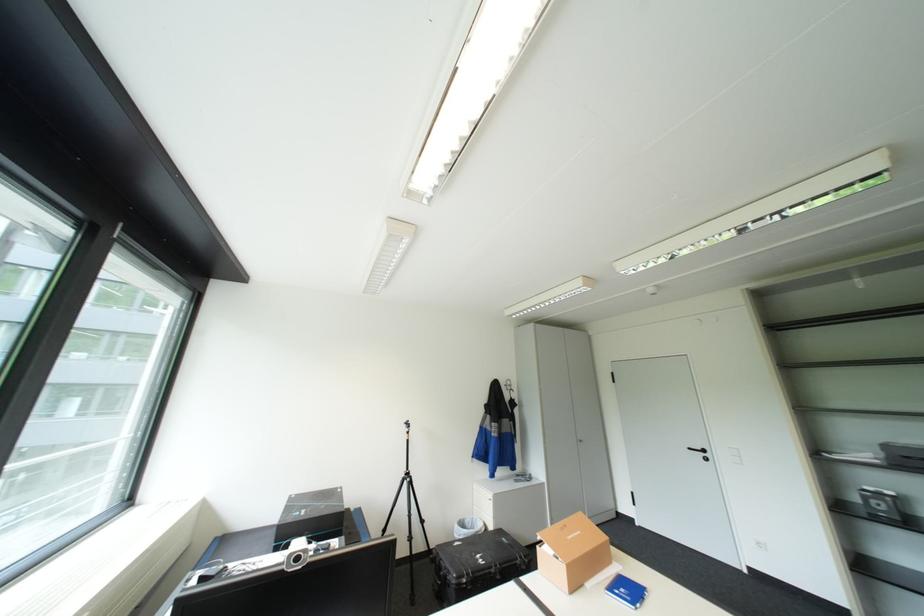
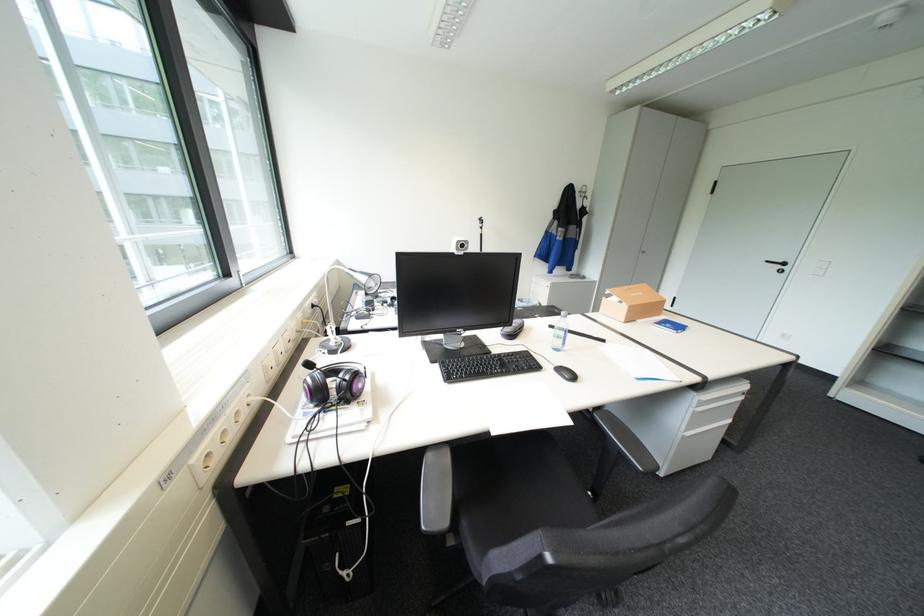
Question: How did the camera likely rotate?

Choices:
 (A) Left
 (B) Right
 (C) Up
 (D) Down

Answer: (D)